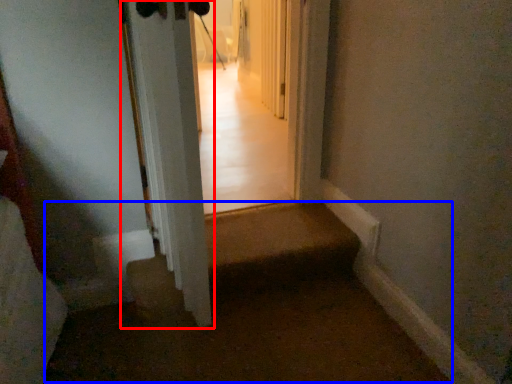
Question: Which of the following is the farthest to the observer, door (highlighted by a red box) or corridor (highlighted by a blue box)?

Choices:
 (A) door
 (B) corridor

Answer: (B)